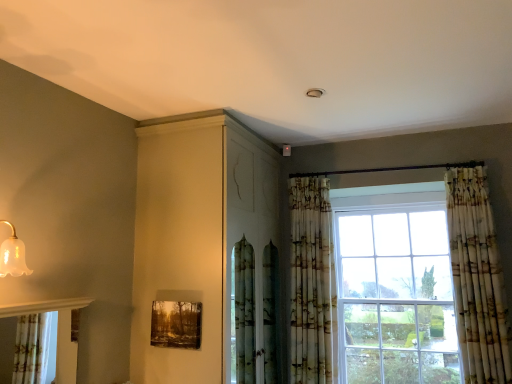
Question: Would you say printed fabric curtain at right, positioned as the first curtain in right-to-left order, contains translucent glass bell at upper left?

Choices:
 (A) yes
 (B) no

Answer: (B)

Question: Is printed fabric curtain at right, positioned as the first curtain in right-to-left order, aimed at translucent glass bell at upper left?

Choices:
 (A) no
 (B) yes

Answer: (A)

Question: Does printed fabric curtain at right, positioned as the first curtain in right-to-left order, appear on the right side of translucent glass bell at upper left?

Choices:
 (A) yes
 (B) no

Answer: (A)

Question: Can you confirm if printed fabric curtain at right, positioned as the first curtain in right-to-left order, is bigger than translucent glass bell at upper left?

Choices:
 (A) no
 (B) yes

Answer: (B)

Question: Is printed fabric curtain at right, positioned as the first curtain in right-to-left order, wider than translucent glass bell at upper left?

Choices:
 (A) no
 (B) yes

Answer: (B)

Question: Is printed fabric curtain at right, positioned as the first curtain in right-to-left order, smaller than translucent glass bell at upper left?

Choices:
 (A) no
 (B) yes

Answer: (A)

Question: Is matte white cabinet at upper center oriented away from translucent glass bell at upper left?

Choices:
 (A) yes
 (B) no

Answer: (B)

Question: Would you say matte white cabinet at upper center is a long distance from translucent glass bell at upper left?

Choices:
 (A) yes
 (B) no

Answer: (B)

Question: Can you confirm if matte white cabinet at upper center is bigger than translucent glass bell at upper left?

Choices:
 (A) yes
 (B) no

Answer: (A)

Question: Is matte white cabinet at upper center in front of translucent glass bell at upper left?

Choices:
 (A) yes
 (B) no

Answer: (B)

Question: Is matte white cabinet at upper center thinner than translucent glass bell at upper left?

Choices:
 (A) no
 (B) yes

Answer: (A)

Question: Is matte white cabinet at upper center to the right of translucent glass bell at upper left from the viewer's perspective?

Choices:
 (A) no
 (B) yes

Answer: (B)

Question: Is wooden textured frame at lower center completely or partially outside of printed fabric curtain at right, which is the 2th curtain in left-to-right order?

Choices:
 (A) no
 (B) yes

Answer: (B)